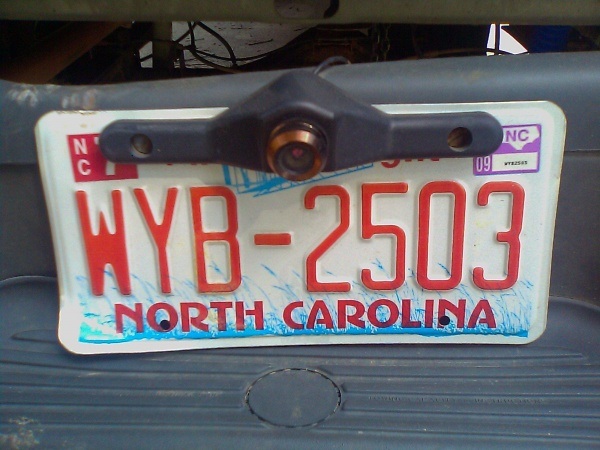
I want to click on screw holes, so click(x=166, y=325), click(x=442, y=317).